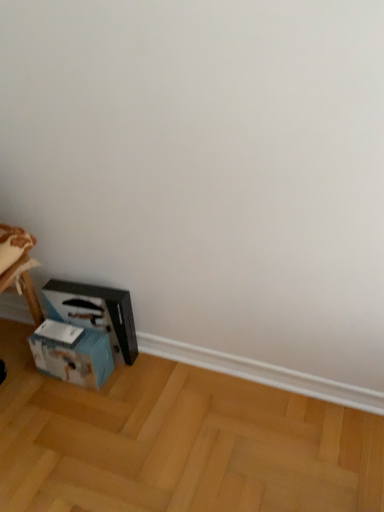
You are a GUI agent. You are given a task and a screenshot of the screen. Output one action in this format:
    pyautogui.click(x=<x>, y=<y>)
    Task: Click on the vacant space situated above blue cardboard box at lower left (from a real-world perspective)
    This screenshot has width=384, height=512.
    Given the screenshot: What is the action you would take?
    pyautogui.click(x=66, y=331)